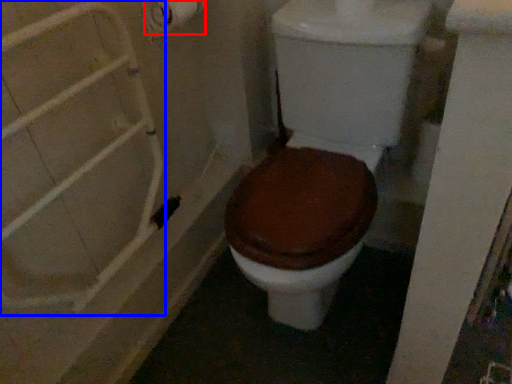
Question: Among these objects, which one is nearest to the camera, toilet paper (highlighted by a red box) or shower door (highlighted by a blue box)?

Choices:
 (A) toilet paper
 (B) shower door

Answer: (B)